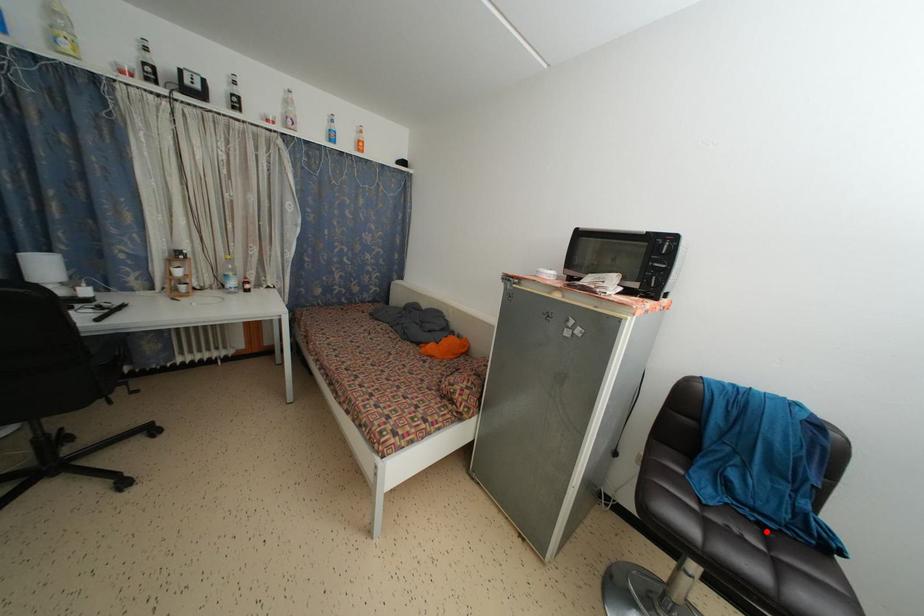
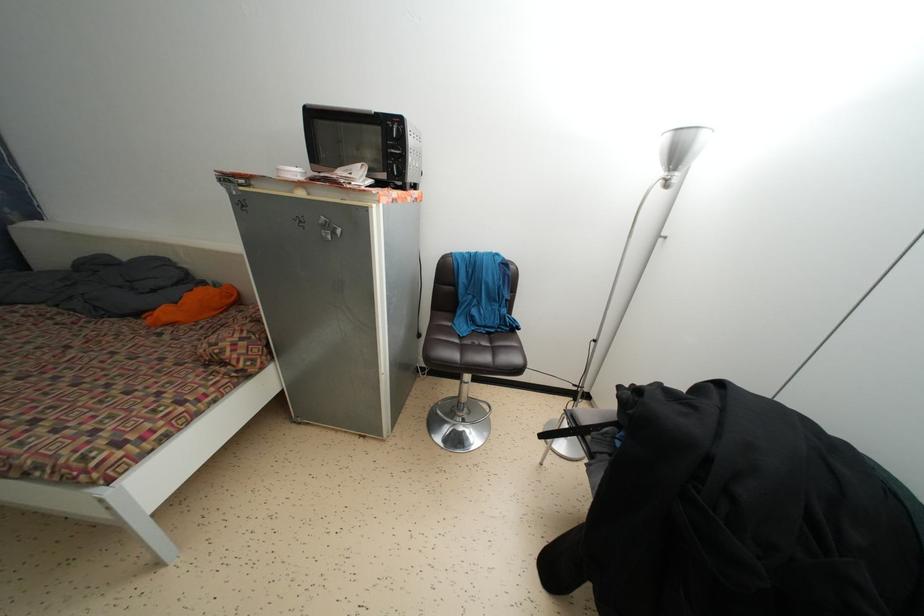
Where in the second image is the point corresponding to the highlighted location from the first image?

(492, 339)